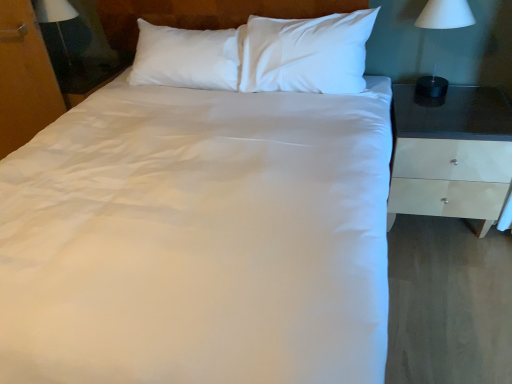
At what (x,y) coordinates should I click in order to perform the action: click on free spot in front of white matte lamp at right, the 2th bedside lamp from the back. Please return your answer as a coordinate pair (x, y). Looking at the image, I should click on (437, 107).